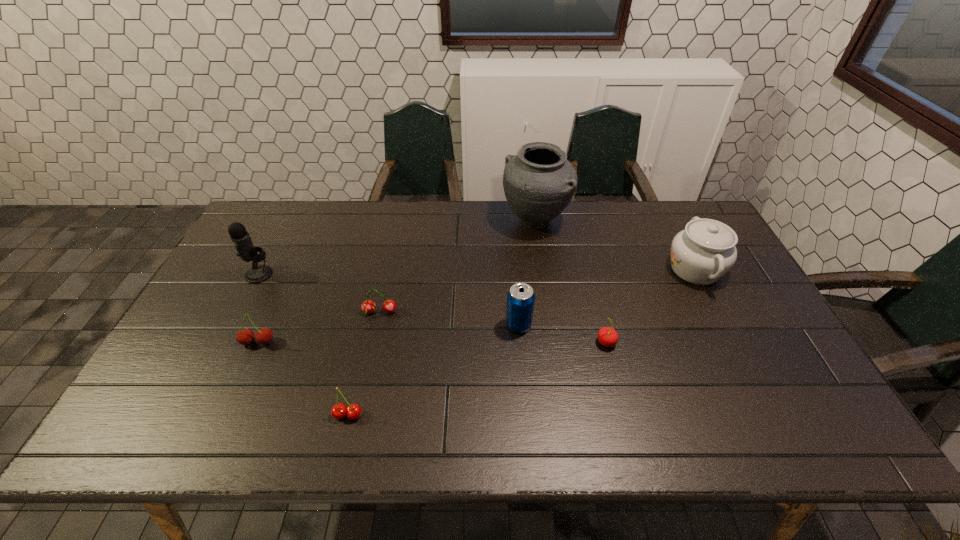
Find the location of a particular element. The image size is (960, 540). the farthest cherry is located at coordinates (368, 306).

This screenshot has width=960, height=540. Identify the location of the nearest cherry. (339, 410).

Where is `free spot located 0.110m on the left of the farthest object`? free spot located 0.110m on the left of the farthest object is located at coordinates (469, 221).

Where is `vacant space located on the front of the leftmost object`? The height and width of the screenshot is (540, 960). vacant space located on the front of the leftmost object is located at coordinates (231, 327).

This screenshot has width=960, height=540. In order to click on vacant space located on the back of the third tallest object in this screenshot , I will do `click(678, 235)`.

Find the location of a particular element. Image resolution: width=960 pixels, height=540 pixels. vacant space located on the back of the pop soda is located at coordinates (513, 252).

You are a GUI agent. You are given a task and a screenshot of the screen. Output one action in this format:
    pyautogui.click(x=<x>, y=<y>)
    Task: Click on the vacant space located 0.200m on the surface of the second object from left to right
    
    Given the screenshot: What is the action you would take?
    pyautogui.click(x=223, y=420)

I want to click on free space located 0.080m on the back of the rightmost cherry, so click(598, 312).

The height and width of the screenshot is (540, 960). In order to click on free spot located with stems pointing upwards on the farthest cherry in this screenshot , I will do `click(372, 353)`.

The width and height of the screenshot is (960, 540). I want to click on object at the far edge, so click(539, 182).